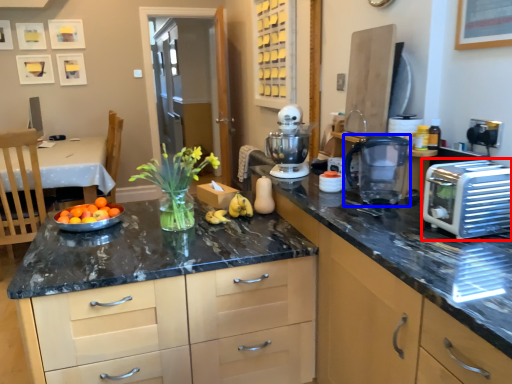
Question: Which point is closer to the camera, toaster (highlighted by a red box) or kitchen appliance (highlighted by a blue box)?

Choices:
 (A) toaster
 (B) kitchen appliance

Answer: (A)